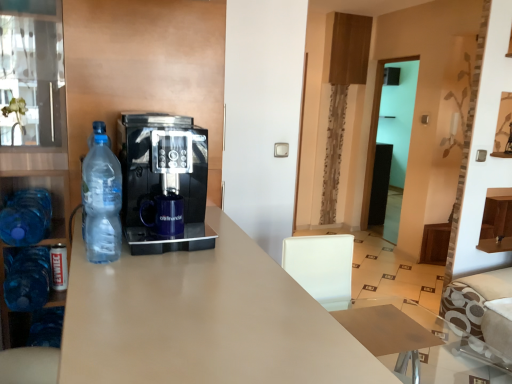
Question: From a real-world perspective, does clear plastic bottle at left, the 1th bottle from the top, stand above matte beige desk at center?

Choices:
 (A) yes
 (B) no

Answer: (A)

Question: Can you confirm if clear plastic bottle at left, the third bottle from the bottom, is wider than matte beige desk at center?

Choices:
 (A) no
 (B) yes

Answer: (A)

Question: Can you confirm if clear plastic bottle at left, which is the third bottle in back-to-front order, is shorter than matte beige desk at center?

Choices:
 (A) no
 (B) yes

Answer: (B)

Question: Would you say clear plastic bottle at left, which is the third bottle in back-to-front order, is outside matte beige desk at center?

Choices:
 (A) no
 (B) yes

Answer: (B)

Question: Is the position of clear plastic bottle at left, the third bottle from the bottom, more distant than that of matte beige desk at center?

Choices:
 (A) yes
 (B) no

Answer: (A)

Question: Is clear plastic bottle at left, the third bottle from the bottom, in front of matte beige desk at center?

Choices:
 (A) yes
 (B) no

Answer: (B)

Question: Does blue plastic bottle at left, the 2th bottle viewed from the right, turn towards transparent glass door at center?

Choices:
 (A) no
 (B) yes

Answer: (A)

Question: Does blue plastic bottle at left, the 2th bottle viewed from the right, appear on the right side of transparent glass door at center?

Choices:
 (A) yes
 (B) no

Answer: (B)

Question: Are blue plastic bottle at left, the 2th bottle viewed from the right, and transparent glass door at center far apart?

Choices:
 (A) no
 (B) yes

Answer: (B)

Question: Can you confirm if blue plastic bottle at left, which is the 2th bottle from front to back, is wider than transparent glass door at center?

Choices:
 (A) no
 (B) yes

Answer: (B)

Question: Is blue plastic bottle at left, marked as the second bottle in a left-to-right arrangement, with transparent glass door at center?

Choices:
 (A) no
 (B) yes

Answer: (A)

Question: Is blue plastic bottle at left, which is the second bottle from bottom to top, positioned beyond the bounds of transparent glass door at center?

Choices:
 (A) yes
 (B) no

Answer: (A)

Question: Does matte beige desk at center have a greater height compared to blue glass cabinet at left?

Choices:
 (A) yes
 (B) no

Answer: (B)